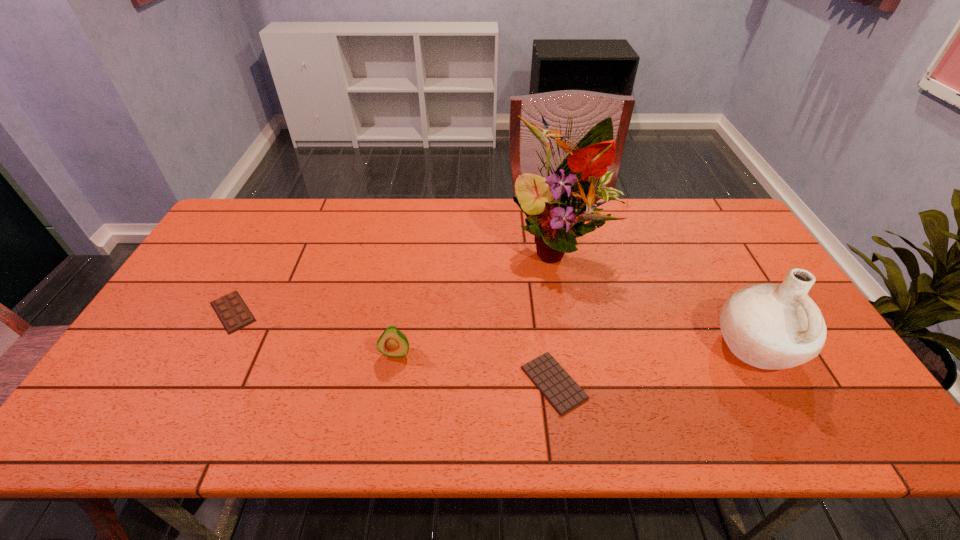
Where is `free space between the right chocolate bar and the bouquet`? This screenshot has width=960, height=540. free space between the right chocolate bar and the bouquet is located at coordinates (556, 314).

What are the coordinates of `empty location between the rightmost object and the fourth object from right to left` in the screenshot? It's located at (576, 349).

Identify the location of vacant region between the fourth shortest object and the leftmost object. (494, 329).

The image size is (960, 540). Find the location of `free spot between the pottery and the farther chocolate bar`. free spot between the pottery and the farther chocolate bar is located at coordinates (x=494, y=329).

This screenshot has width=960, height=540. I want to click on vacant space that is in between the avocado and the bouquet, so [x=476, y=299].

Locate an element on the screen. The image size is (960, 540). object that is the closest one to the rightmost object is located at coordinates (557, 207).

Image resolution: width=960 pixels, height=540 pixels. I want to click on the third closest object to the shortest object, so click(769, 326).

Find the location of `vacant space that satisfies the following two spatial constraints: 1. on the cut side of the avocado; 2. on the left side of the nearer chocolate bar`. vacant space that satisfies the following two spatial constraints: 1. on the cut side of the avocado; 2. on the left side of the nearer chocolate bar is located at coordinates (391, 383).